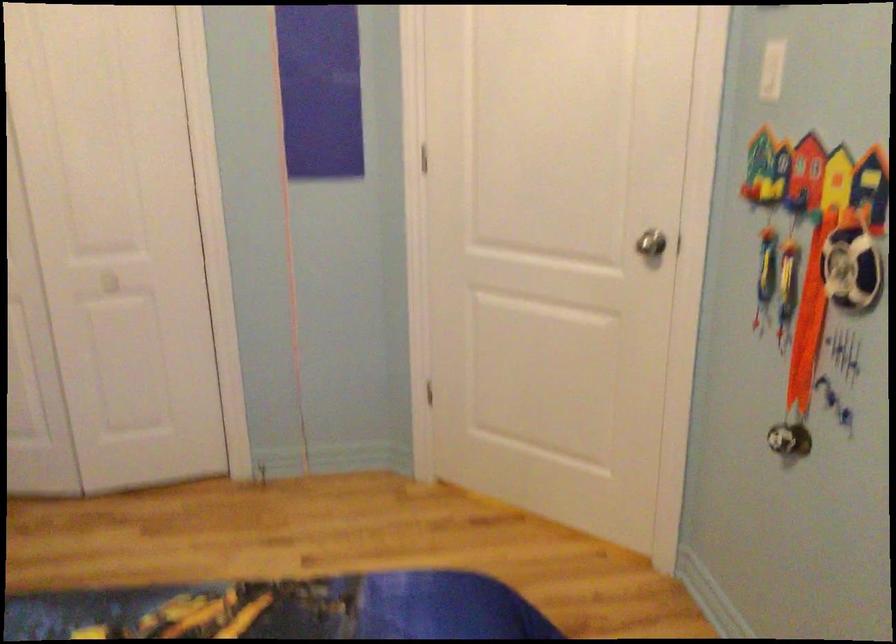
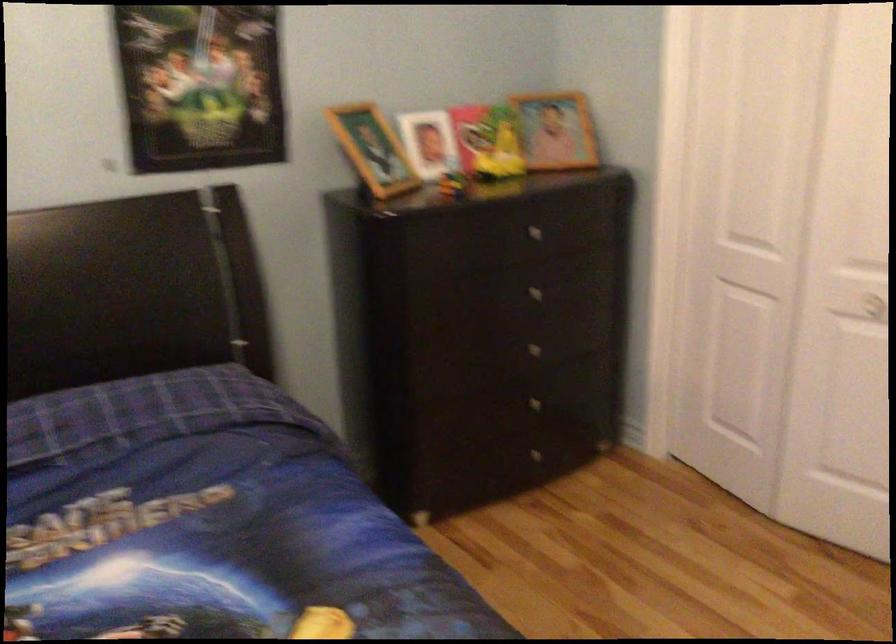
The point at (88, 290) is marked in the first image. Where is the corresponding point in the second image?

(864, 305)